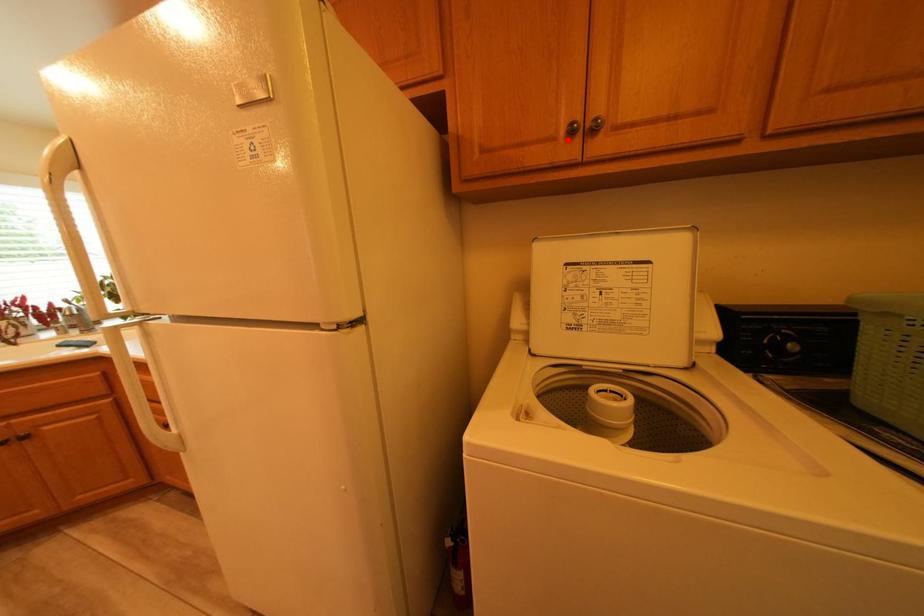
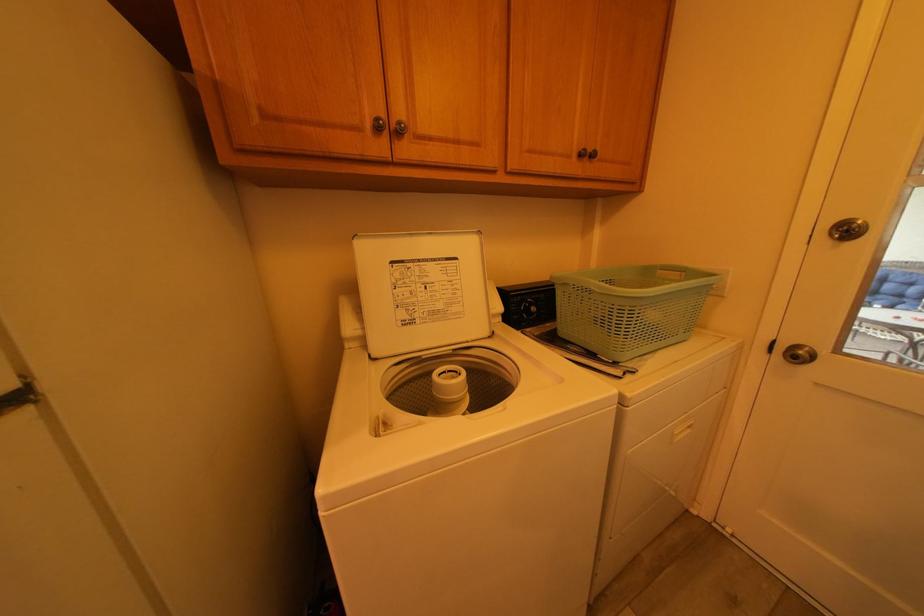
The point at the highlighted location is marked in the first image. Where is the corresponding point in the second image?

(373, 130)